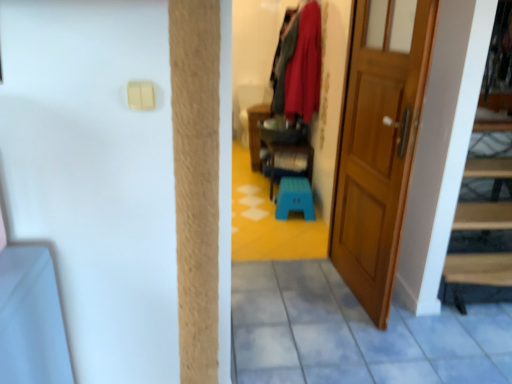
In order to face velvet red coat at upper center, should I rotate leftwards or rightwards?

It's best to rotate right around 3.927 degrees.

How much space does wooden cabinet at center, positioned as the second furniture in right-to-left order, occupy vertically?

→ 29.45 inches.

Measure the distance between point (307, 168) and camera.

Point (307, 168) is 3.83 meters from camera.

Looking at this image, measure the distance between point (244, 130) and camera.

The distance of point (244, 130) from camera is 15.18 feet.

This screenshot has height=384, width=512. Describe the element at coordinates (250, 105) in the screenshot. I see `wooden armchair at center` at that location.

The height and width of the screenshot is (384, 512). Identify the location of blue plastic step stool at center. (294, 198).

Is blue plastic step stool at center far away from velvet red coat at upper center?

No, blue plastic step stool at center is not far away from velvet red coat at upper center.

Locate an element on the screen. Image resolution: width=512 pixels, height=384 pixels. step stool lying on the right of velvet red coat at upper center is located at coordinates (294, 198).

Which point is more distant from viewer, (296, 184) or (286, 63)?

Positioned behind is point (296, 184).

Considering the relative sizes of blue plastic step stool at center and velvet red coat at upper center in the image provided, is blue plastic step stool at center wider than velvet red coat at upper center?

Correct, the width of blue plastic step stool at center exceeds that of velvet red coat at upper center.

From a real-world perspective, is wooden armchair at center above or below teal plastic stool at center, marked as the 1th furniture in a right-to-left arrangement?

From a real-world perspective, wooden armchair at center is physically above teal plastic stool at center, marked as the 1th furniture in a right-to-left arrangement.

From the image's perspective, does wooden armchair at center appear lower than teal plastic stool at center, marked as the 1th furniture in a right-to-left arrangement?

Actually, wooden armchair at center appears above teal plastic stool at center, marked as the 1th furniture in a right-to-left arrangement, in the image.

Relative to teal plastic stool at center, marked as the 1th furniture in a right-to-left arrangement, is wooden armchair at center in front or behind?

wooden armchair at center is behind teal plastic stool at center, marked as the 1th furniture in a right-to-left arrangement.

Considering the sizes of objects velvet red coat at upper center and wooden armchair at center in the image provided, who is thinner, velvet red coat at upper center or wooden armchair at center?

velvet red coat at upper center is thinner.

Is velvet red coat at upper center oriented away from wooden armchair at center?

Yes, velvet red coat at upper center's orientation is away from wooden armchair at center.

From the image's perspective, is velvet red coat at upper center under wooden armchair at center?

Incorrect, from the image's perspective, velvet red coat at upper center is higher than wooden armchair at center.

Is velvet red coat at upper center next to wooden armchair at center and touching it?

velvet red coat at upper center and wooden armchair at center are not in contact.

Is blue plastic step stool at center positioned far away from wooden armchair at center?

Yes.

Is point (307, 207) closer or farther from the camera than point (249, 86)?

Point (307, 207) is closer to the camera than point (249, 86).

From the image's perspective, is blue plastic step stool at center located above or below wooden armchair at center?

blue plastic step stool at center is below wooden armchair at center.

From a real-world perspective, who is located lower, blue plastic step stool at center or wooden armchair at center?

blue plastic step stool at center is physically lower.

Does wooden cabinet at center, positioned as the second furniture in right-to-left order, have a greater width compared to wooden door at right?

Yes.

From a real-world perspective, starting from the wooden door at right, which furniture is the 1st one below it? Please provide its 2D coordinates.

[(256, 132)]

Is wooden cabinet at center, arranged as the 1th furniture when viewed from the left, located outside wooden door at right?

Indeed, wooden cabinet at center, arranged as the 1th furniture when viewed from the left, is completely outside wooden door at right.

Can you confirm if wooden cabinet at center, arranged as the 1th furniture when viewed from the left, is smaller than wooden door at right?

Yes.

Which of these two, wooden cabinet at center, positioned as the second furniture in right-to-left order, or velvet red coat at upper center, is wider?

wooden cabinet at center, positioned as the second furniture in right-to-left order.

Is velvet red coat at upper center at the back of wooden cabinet at center, arranged as the 1th furniture when viewed from the left?

No, wooden cabinet at center, arranged as the 1th furniture when viewed from the left,'s orientation is not away from velvet red coat at upper center.

Considering the sizes of wooden cabinet at center, arranged as the 1th furniture when viewed from the left, and velvet red coat at upper center in the image, is wooden cabinet at center, arranged as the 1th furniture when viewed from the left, bigger or smaller than velvet red coat at upper center?

Considering their sizes, wooden cabinet at center, arranged as the 1th furniture when viewed from the left, takes up more space than velvet red coat at upper center.

Can you confirm if blue plastic step stool at center is smaller than wooden cabinet at center, arranged as the 1th furniture when viewed from the left?

Yes.

Between blue plastic step stool at center and wooden cabinet at center, arranged as the 1th furniture when viewed from the left, which one has larger width?

wooden cabinet at center, arranged as the 1th furniture when viewed from the left, is wider.

Choose the correct answer: Is blue plastic step stool at center inside wooden cabinet at center, positioned as the second furniture in right-to-left order, or outside it?

The correct answer is: outside.

From the picture: Is blue plastic step stool at center taller or shorter than wooden cabinet at center, arranged as the 1th furniture when viewed from the left?

In the image, blue plastic step stool at center appears to be shorter than wooden cabinet at center, arranged as the 1th furniture when viewed from the left.

This screenshot has width=512, height=384. What are the coordinates of `step stool that appears behind the velvet red coat at upper center` in the screenshot? It's located at (294, 198).

Where is `the 2nd furniture in front of the wooden armchair at center, counting from the anchor's position`? the 2nd furniture in front of the wooden armchair at center, counting from the anchor's position is located at coordinates (290, 152).

Looking at this image, looking at the image, which one is located closer to velvet red coat at upper center, wooden armchair at center or wooden door at right?

→ wooden armchair at center.

Estimate the real-world distances between objects in this image. Which object is closer to wooden cabinet at center, arranged as the 1th furniture when viewed from the left, teal plastic stool at center, placed as the second furniture when sorted from left to right, or velvet red coat at upper center?

Among the two, teal plastic stool at center, placed as the second furniture when sorted from left to right, is located nearer to wooden cabinet at center, arranged as the 1th furniture when viewed from the left.

When comparing their distances from wooden armchair at center, does wooden cabinet at center, arranged as the 1th furniture when viewed from the left, or velvet red coat at upper center seem further?

The object further to wooden armchair at center is velvet red coat at upper center.

Estimate the real-world distances between objects in this image. Which object is closer to wooden armchair at center, velvet red coat at upper center or wooden cabinet at center, positioned as the second furniture in right-to-left order?

wooden cabinet at center, positioned as the second furniture in right-to-left order, lies closer to wooden armchair at center than the other object.

Based on their spatial positions, is wooden cabinet at center, positioned as the second furniture in right-to-left order, or velvet red coat at upper center further from blue plastic step stool at center?

Based on the image, wooden cabinet at center, positioned as the second furniture in right-to-left order, appears to be further to blue plastic step stool at center.

When comparing their distances from blue plastic step stool at center, does wooden armchair at center or teal plastic stool at center, placed as the second furniture when sorted from left to right, seem further?

Among the two, wooden armchair at center is located further to blue plastic step stool at center.

From the image, which object appears to be nearer to velvet red coat at upper center, wooden cabinet at center, positioned as the second furniture in right-to-left order, or wooden door at right?

Based on the image, wooden cabinet at center, positioned as the second furniture in right-to-left order, appears to be nearer to velvet red coat at upper center.

Based on the photo, from the image, which object appears to be nearer to wooden door at right, wooden armchair at center or velvet red coat at upper center?

Based on the image, velvet red coat at upper center appears to be nearer to wooden door at right.

In order to click on clothing between wooden door at right and teal plastic stool at center, placed as the second furniture when sorted from left to right, in the front-back direction in this screenshot , I will do `click(300, 67)`.

Find the location of a particular element. This screenshot has width=512, height=384. clothing between wooden door at right and blue plastic step stool at center from front to back is located at coordinates (300, 67).

Locate an element on the screen. furniture positioned between wooden door at right and wooden cabinet at center, arranged as the 1th furniture when viewed from the left, from near to far is located at coordinates (290, 152).

Identify the location of furniture between velvet red coat at upper center and wooden cabinet at center, positioned as the second furniture in right-to-left order, from front to back. (290, 152).